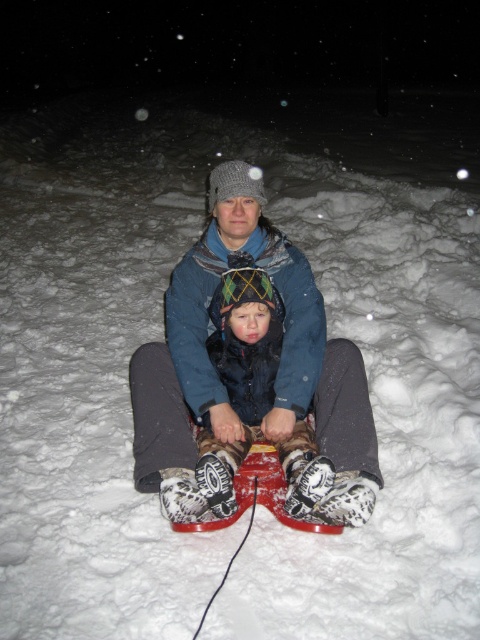
Question: Where is matte blue jacket at center located in relation to plush woolen hat at center in the image?

Choices:
 (A) above
 (B) below

Answer: (A)

Question: Can you confirm if matte blue jacket at center is positioned to the right of plush woolen hat at center?

Choices:
 (A) yes
 (B) no

Answer: (B)

Question: Does matte blue jacket at center have a greater width compared to plush woolen hat at center?

Choices:
 (A) yes
 (B) no

Answer: (A)

Question: Among these objects, which one is nearest to the camera?

Choices:
 (A) plush woolen hat at center
 (B) matte blue jacket at center

Answer: (A)

Question: Which point is closer to the camera?

Choices:
 (A) (360, 420)
 (B) (214, 452)

Answer: (B)